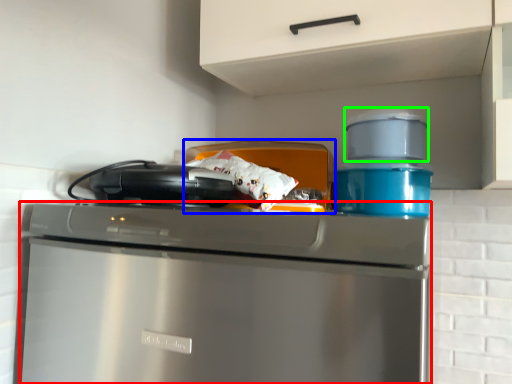
Question: Estimate the real-world distances between objects in this image. Which object is closer to home appliance (highlighted by a red box), appliance (highlighted by a blue box) or appliance (highlighted by a green box)?

Choices:
 (A) appliance
 (B) appliance

Answer: (A)